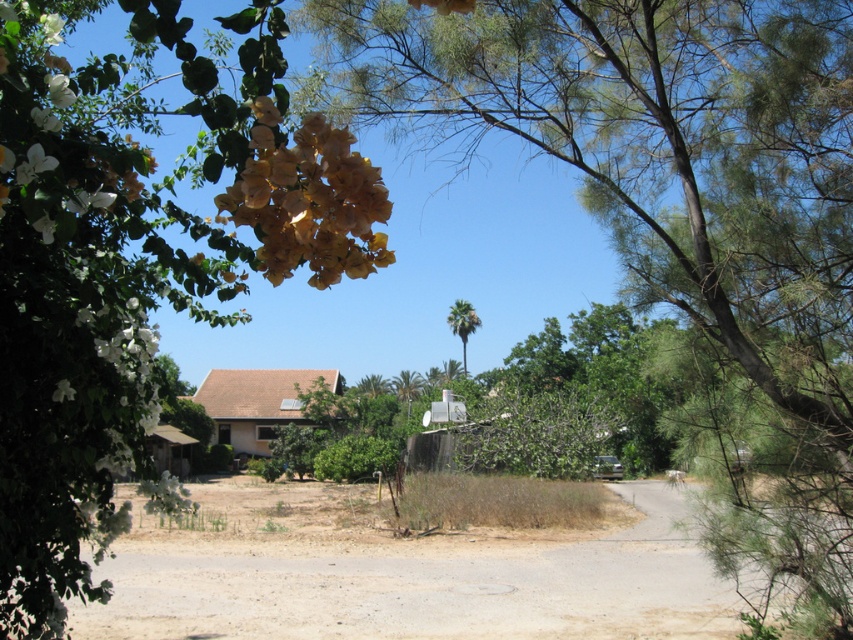
You are a drone operator planning to fly a drone from the green leafy tree at upper right to the yellow matte flower at upper left. The drone has a maximum flight range of 4 meters. Based on the scene, will the drone be able to reach the flower without needing to recharge?

The distance between the green leafy tree at upper right and the yellow matte flower at upper left is 4.40 meters. Since the drone can only fly 4 meters before needing to recharge, it will not be able to reach the flower without recharging.

You are standing at the point marked as point (680, 218) in the image. Looking around, you see a green leafy tree at upper right. What is directly below you?

The point (680, 218) is on the green leafy tree at upper right, so directly below you would be the branches or leaves of the green leafy tree at upper right.

You are a photographer standing at the edge of the dirt road in this suburban scene. You want to capture a photo that includes both the green leafy tree at upper left and the brown dry grass at lower center. Which object should you focus on first to ensure both are in sharp focus?

You should focus on the green leafy tree at upper left first because it is closer to the viewer than the brown dry grass at lower center. By focusing on the closer object, the farther object will also be in focus due to the depth of field.